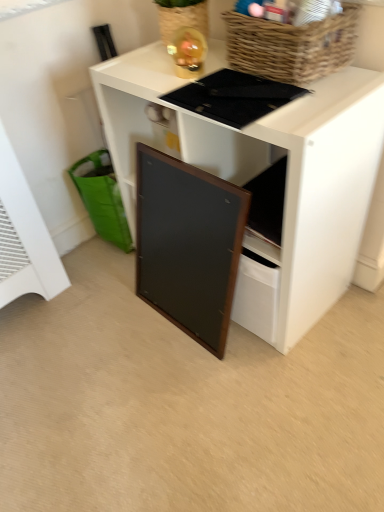
At what (x,y) coordinates should I click in order to perform the action: click on space that is in front of green fabric shopping basket at lower left. Please return your answer as a coordinate pair (x, y). Looking at the image, I should click on (102, 273).